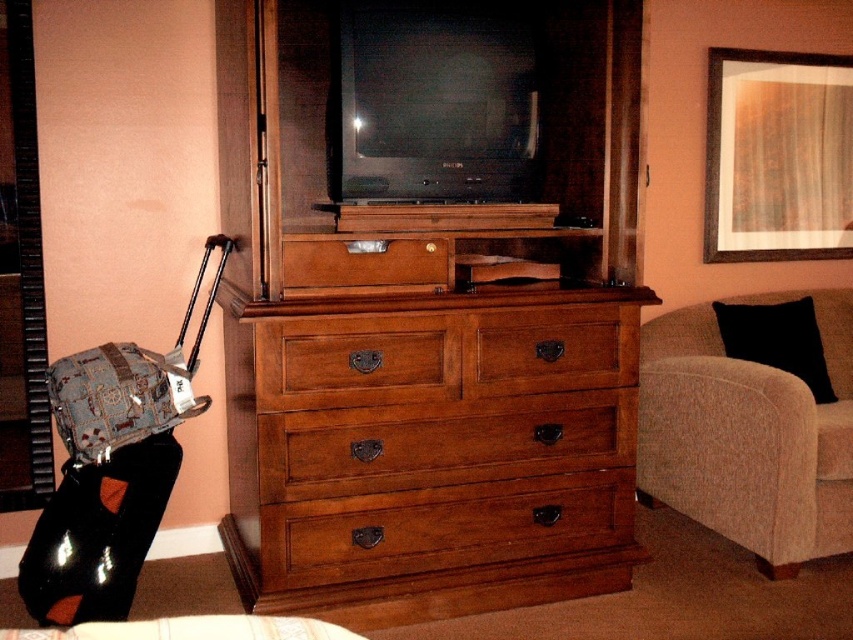
Question: Is wooden dresser at center wider than wooden drawer at center?

Choices:
 (A) no
 (B) yes

Answer: (B)

Question: Can you confirm if wooden drawer at center is bigger than matte black suitcase at left?

Choices:
 (A) no
 (B) yes

Answer: (A)

Question: Does beige fabric couch at right have a greater width compared to matte black suitcase at left?

Choices:
 (A) yes
 (B) no

Answer: (A)

Question: Among these objects, which one is farthest from the camera?

Choices:
 (A) beige fabric couch at right
 (B) matte black suitcase at left
 (C) wooden dresser at center

Answer: (A)

Question: Considering the real-world distances, which object is closest to the brown wood drawer at center?

Choices:
 (A) wooden drawer at center
 (B) beige fabric couch at right
 (C) wooden dresser at center

Answer: (C)

Question: Which point is farther from the camera taking this photo?

Choices:
 (A) (532, 310)
 (B) (274, 618)

Answer: (A)